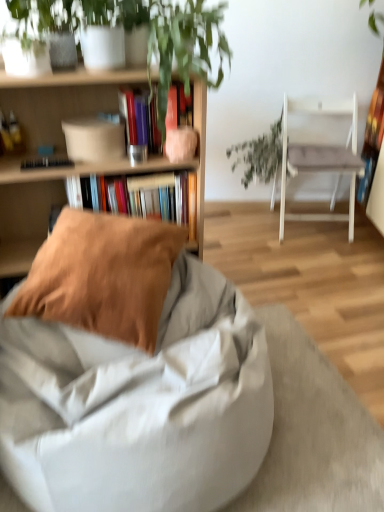
Question: Is hardcover book at center, positioned as the 2th book in bottom-to-top order, far away from green leafy plant at center?

Choices:
 (A) yes
 (B) no

Answer: (A)

Question: Is hardcover book at center, which is counted as the 1th book, starting from the top, turned away from green leafy plant at center?

Choices:
 (A) yes
 (B) no

Answer: (B)

Question: Is hardcover book at center, which is counted as the 1th book, starting from the top, taller than green leafy plant at center?

Choices:
 (A) yes
 (B) no

Answer: (B)

Question: Is hardcover book at center, positioned as the 2th book in bottom-to-top order, with green leafy plant at center?

Choices:
 (A) no
 (B) yes

Answer: (A)

Question: Can you confirm if hardcover book at center, which is counted as the 1th book, starting from the top, is shorter than green leafy plant at center?

Choices:
 (A) yes
 (B) no

Answer: (A)

Question: Looking at their shapes, would you say white fabric chair at right, acting as the second chair starting from the left, is wider or thinner than green leafy plant at center?

Choices:
 (A) wide
 (B) thin

Answer: (A)

Question: From a real-world perspective, relative to green leafy plant at center, is white fabric chair at right, acting as the second chair starting from the bottom, vertically above or below?

Choices:
 (A) above
 (B) below

Answer: (A)

Question: Choose the correct answer: Is white fabric chair at right, placed as the 1th chair when sorted from back to front, inside green leafy plant at center or outside it?

Choices:
 (A) outside
 (B) inside

Answer: (A)

Question: In terms of size, does white fabric chair at right, acting as the second chair starting from the left, appear bigger or smaller than green leafy plant at center?

Choices:
 (A) big
 (B) small

Answer: (A)

Question: From their relative heights in the image, would you say green leafy plant at center is taller or shorter than wooden bookshelf at upper left?

Choices:
 (A) tall
 (B) short

Answer: (B)

Question: Based on their positions, is green leafy plant at center located to the left or right of wooden bookshelf at upper left?

Choices:
 (A) right
 (B) left

Answer: (A)

Question: From a real-world perspective, relative to wooden bookshelf at upper left, is green leafy plant at center vertically above or below?

Choices:
 (A) above
 (B) below

Answer: (B)

Question: From the image's perspective, is green leafy plant at center located above or below wooden bookshelf at upper left?

Choices:
 (A) below
 (B) above

Answer: (B)

Question: Considering the positions of light gray fabric bean bag at center, the 1th chair positioned from the bottom, and hardcover book at center, positioned as the 2th book in bottom-to-top order, in the image, is light gray fabric bean bag at center, the 1th chair positioned from the bottom, bigger or smaller than hardcover book at center, positioned as the 2th book in bottom-to-top order,?

Choices:
 (A) small
 (B) big

Answer: (B)

Question: Considering the positions of light gray fabric bean bag at center, which appears as the second chair when viewed from the right, and hardcover book at center, which is counted as the 1th book, starting from the top, in the image, is light gray fabric bean bag at center, which appears as the second chair when viewed from the right, wider or thinner than hardcover book at center, which is counted as the 1th book, starting from the top,?

Choices:
 (A) wide
 (B) thin

Answer: (A)